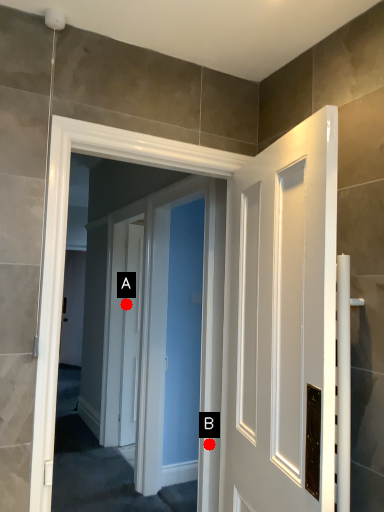
Question: Two points are circled on the image, labeled by A and B beside each circle. Which point is farther from the camera taking this photo?

Choices:
 (A) A is further
 (B) B is further

Answer: (A)